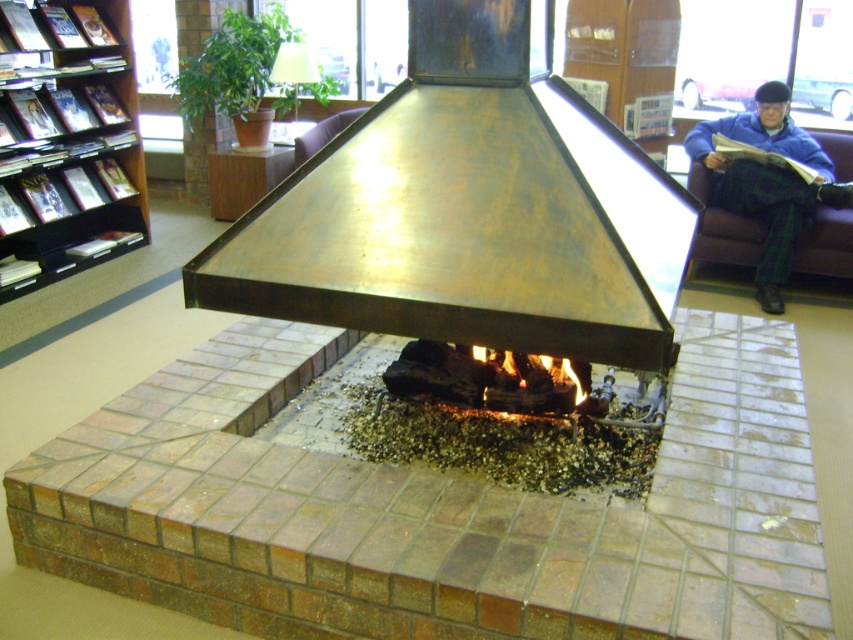
You are a photographer trying to capture the blue plaid pants at upper right and the charcoal black wood at center in the same frame. Given that the camera can only focus on objects within a certain height range, which object might be out of focus if the focus is set to the height of the shorter object?

The blue plaid pants at upper right is much taller than the charcoal black wood at center. If the focus is set to the height of the shorter charcoal black wood at center, the taller blue plaid pants at upper right might be out of focus.

You are standing in the cozy indoor setting with the fireplace. You need to place a decorative item on the spot marked by the blue plaid pants at upper right. Is this location near the fireplace or the bookshelf?

The blue plaid pants at upper right is located at point coordinates that are closer to the fireplace. Since the coordinates are at the upper right of the scene, it would be near the fireplace rather than the bookshelf in the background.

You are standing in the cozy indoor setting with the fireplace. You need to locate the blue plaid pants at upper right. Where exactly are they positioned in terms of coordinates?

The blue plaid pants at upper right are located at the coordinates point (764, 180).